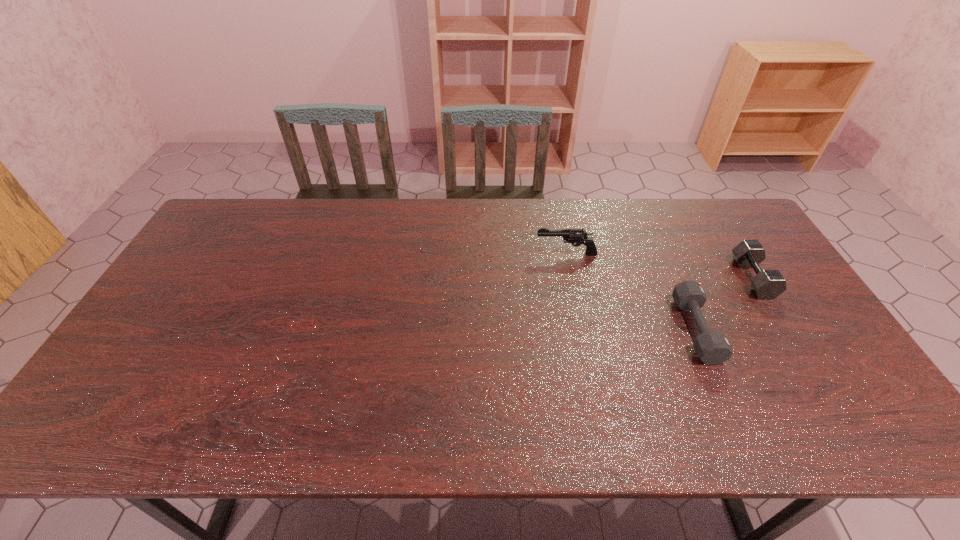
Where is `vacant space that satisfies the following two spatial constraints: 1. at the end of the barrel of the left dumbbell; 2. on the right side of the tallest object`? The width and height of the screenshot is (960, 540). vacant space that satisfies the following two spatial constraints: 1. at the end of the barrel of the left dumbbell; 2. on the right side of the tallest object is located at coordinates (582, 329).

Identify the location of vacant region that satisfies the following two spatial constraints: 1. at the end of the barrel of the left dumbbell; 2. on the left side of the leftmost object. 582,329.

Locate an element on the screen. The image size is (960, 540). free location that satisfies the following two spatial constraints: 1. at the end of the barrel of the gun; 2. on the back side of the rightmost object is located at coordinates (571, 278).

Find the location of a particular element. free region that satisfies the following two spatial constraints: 1. at the end of the barrel of the gun; 2. on the left side of the left dumbbell is located at coordinates (582, 329).

The width and height of the screenshot is (960, 540). Identify the location of vacant region that satisfies the following two spatial constraints: 1. at the end of the barrel of the gun; 2. on the left side of the right dumbbell. (571, 278).

The image size is (960, 540). Identify the location of vacant position in the image that satisfies the following two spatial constraints: 1. at the end of the barrel of the gun; 2. on the back side of the rightmost object. (571, 278).

Image resolution: width=960 pixels, height=540 pixels. Identify the location of vacant space that satisfies the following two spatial constraints: 1. at the end of the barrel of the gun; 2. on the back side of the second object from left to right. (582, 329).

You are a GUI agent. You are given a task and a screenshot of the screen. Output one action in this format:
    pyautogui.click(x=<x>, y=<y>)
    Task: Click on the vacant area in the image that satisfies the following two spatial constraints: 1. at the end of the barrel of the gun; 2. on the left side of the rightmost object
    The width and height of the screenshot is (960, 540).
    Given the screenshot: What is the action you would take?
    pyautogui.click(x=571, y=278)